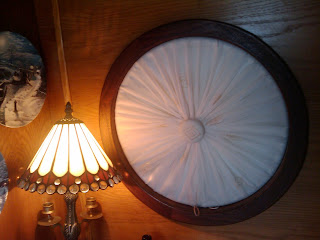
At what (x,y) coordinates should I click in order to perform the action: click on window pane/rim. Please return your answer as a coordinate pair (x, y). The height and width of the screenshot is (240, 320). Looking at the image, I should click on (116, 72).